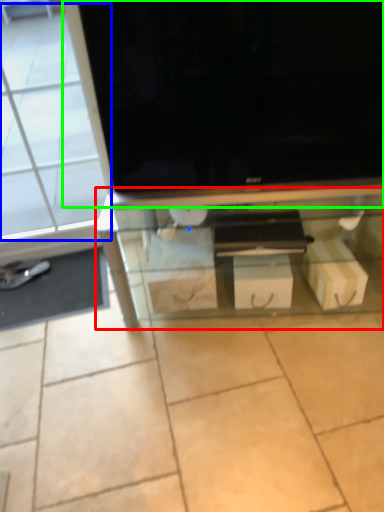
Question: Estimate the real-world distances between objects in this image. Which object is farther from shelf (highlighted by a red box), glass door (highlighted by a blue box) or television (highlighted by a green box)?

Choices:
 (A) glass door
 (B) television

Answer: (A)